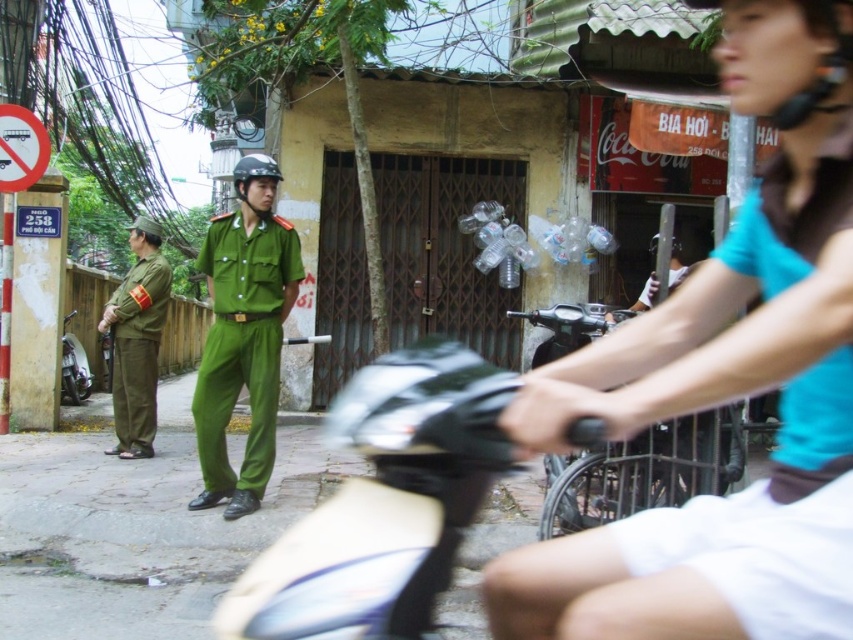
From the picture: You are a pedestrian on the street and notice the green uniform at left and the black matte helmet at center. Which object is taller when viewed from your perspective?

The green uniform at left is taller than the black matte helmet at center.